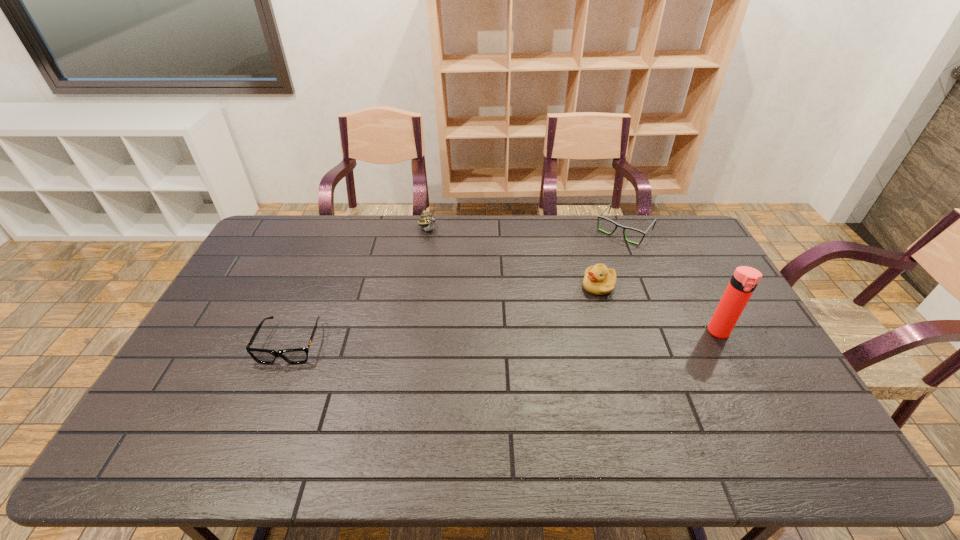
Where is `vacant area situated 0.100m on the front-facing side of the third nearest object`? The height and width of the screenshot is (540, 960). vacant area situated 0.100m on the front-facing side of the third nearest object is located at coordinates (564, 307).

Identify the location of vacant space located on the front-facing side of the third nearest object. (514, 338).

Where is `vacant region located 0.290m on the front-facing side of the third nearest object`? vacant region located 0.290m on the front-facing side of the third nearest object is located at coordinates (519, 334).

Locate an element on the screen. free space located on the face of the snail is located at coordinates (464, 281).

The height and width of the screenshot is (540, 960). Find the location of `vacant space located on the face of the snail`. vacant space located on the face of the snail is located at coordinates (482, 305).

I want to click on vacant position located on the face of the snail, so click(453, 267).

Where is `blank space located 0.050m on the lens of the spectacles`? Image resolution: width=960 pixels, height=540 pixels. blank space located 0.050m on the lens of the spectacles is located at coordinates (606, 251).

Identify the location of free spot located 0.240m on the lens of the spectacles. The width and height of the screenshot is (960, 540). (582, 279).

At what (x,y) coordinates should I click in order to perform the action: click on vacant space located on the lens of the spectacles. Please return your answer as a coordinate pair (x, y). Looking at the image, I should click on (574, 288).

This screenshot has height=540, width=960. What are the coordinates of `snail present at the far edge` in the screenshot? It's located at (427, 221).